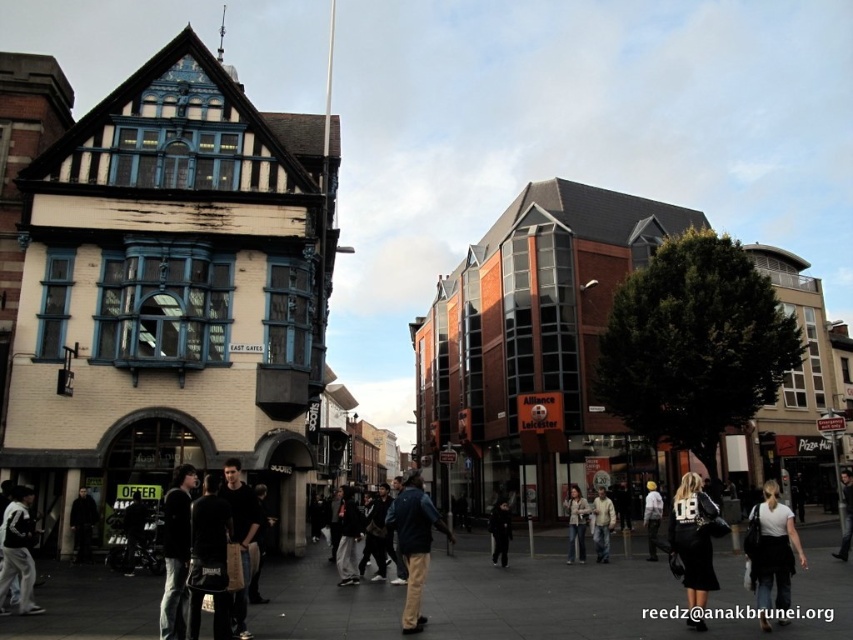
What do you see at coordinates (82, 524) in the screenshot?
I see `black matte jacket at lower left` at bounding box center [82, 524].

Between point (74, 513) and point (576, 490), which one is positioned behind?

Point (576, 490)

Which is in front, point (80, 541) or point (573, 515)?

Point (80, 541) is more forward.

You are a GUI agent. You are given a task and a screenshot of the screen. Output one action in this format:
    pyautogui.click(x=<x>, y=<y>)
    Task: Click on the black matte jacket at lower left
    This screenshot has height=640, width=853.
    Given the screenshot: What is the action you would take?
    pyautogui.click(x=82, y=524)

Is black matte jacket at center above white cotton jacket at center?

No.

Is point (506, 545) farther from camera compared to point (654, 538)?

No.

Where is `black matte jacket at center`? This screenshot has width=853, height=640. black matte jacket at center is located at coordinates (498, 531).

In the scene shown: Is white matte shirt at center positioned behind denim jacket at center?

That is False.

The width and height of the screenshot is (853, 640). What do you see at coordinates (772, 552) in the screenshot?
I see `white matte shirt at center` at bounding box center [772, 552].

Locate an element on the screen. white matte shirt at center is located at coordinates [x=772, y=552].